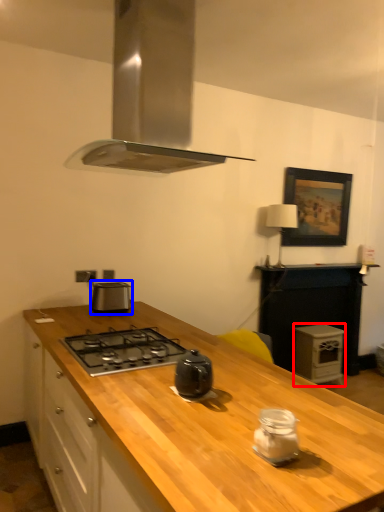
Question: Among these objects, which one is nearest to the camera, appliance (highlighted by a red box) or kitchen appliance (highlighted by a blue box)?

Choices:
 (A) appliance
 (B) kitchen appliance

Answer: (B)